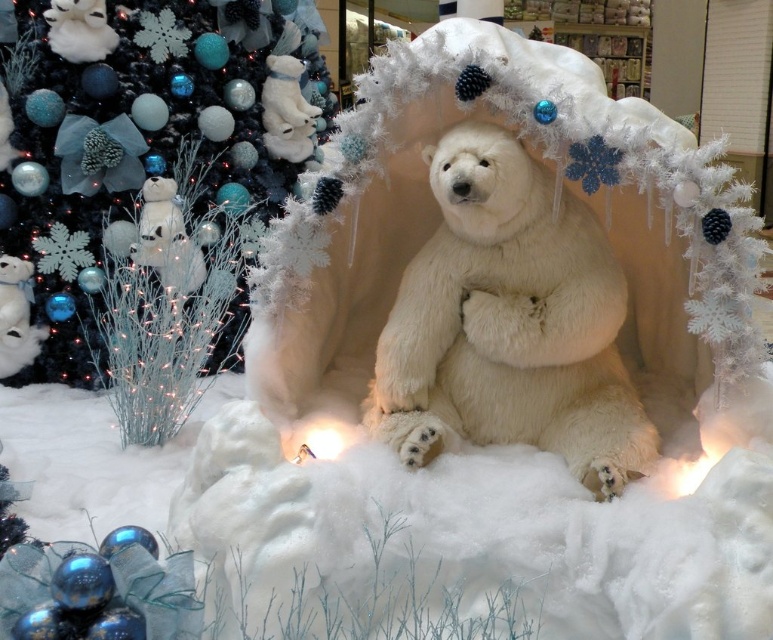
Question: Which object is closer to the camera taking this photo?

Choices:
 (A) white fluffy bear at center
 (B) matte black christmas tree at upper left

Answer: (A)

Question: Can you confirm if matte black christmas tree at upper left is positioned above white fluffy bear at center?

Choices:
 (A) yes
 (B) no

Answer: (A)

Question: Which point appears farthest from the camera in this image?

Choices:
 (A) (90, 227)
 (B) (400, 412)

Answer: (A)

Question: Is matte black christmas tree at upper left smaller than white fluffy bear at center?

Choices:
 (A) yes
 (B) no

Answer: (B)

Question: Does matte black christmas tree at upper left have a smaller size compared to white fluffy bear at center?

Choices:
 (A) no
 (B) yes

Answer: (A)

Question: Which object appears farthest from the camera in this image?

Choices:
 (A) matte black christmas tree at upper left
 (B) white fluffy bear at center

Answer: (A)